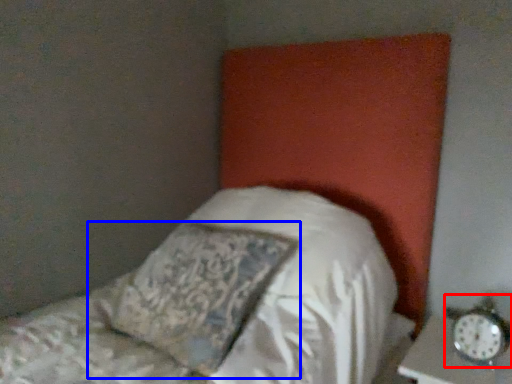
Question: Which of the following is the closest to the observer, alarm clock (highlighted by a red box) or pillow (highlighted by a blue box)?

Choices:
 (A) alarm clock
 (B) pillow

Answer: (B)